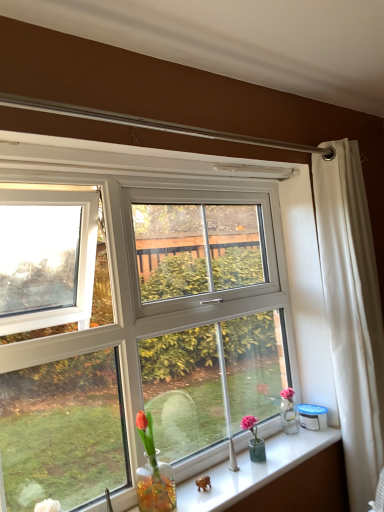
In order to face white fabric curtain at right, should I rotate leftwards or rightwards?

You should rotate right by 22.046 degrees.

What is the approximate width of white fabric curtain at right?

The width of white fabric curtain at right is 7.40 inches.

The image size is (384, 512). Describe the element at coordinates (352, 314) in the screenshot. I see `white fabric curtain at right` at that location.

You are a GUI agent. You are given a task and a screenshot of the screen. Output one action in this format:
    pyautogui.click(x=<x>, y=<y>)
    Task: Click on the white fabric curtain at right
    This screenshot has height=512, width=384.
    Given the screenshot: What is the action you would take?
    pyautogui.click(x=352, y=314)

What do you see at coordinates (253, 470) in the screenshot? This screenshot has width=384, height=512. I see `clear glass vase at lower center` at bounding box center [253, 470].

Locate an element on the screen. clear glass vase at lower center is located at coordinates (253, 470).

At what (x,y) coordinates should I click in order to perform the action: click on white fabric curtain at right. Please return your answer as a coordinate pair (x, y). This screenshot has width=384, height=512. Looking at the image, I should click on (352, 314).

Can you confirm if clear glass vase at lower center is positioned to the right of white fabric curtain at right?

In fact, clear glass vase at lower center is to the left of white fabric curtain at right.

In the scene shown: Who is more distant, clear glass vase at lower center or white fabric curtain at right?

white fabric curtain at right.

Which point is more forward, (311, 508) or (353, 231)?

Positioned in front is point (311, 508).

From the image's perspective, is clear glass vase at lower center below white fabric curtain at right?

Yes.

From a real-world perspective, does clear glass vase at lower center stand above white fabric curtain at right?

No, from a real-world perspective, clear glass vase at lower center is not over white fabric curtain at right

In the scene shown: Is clear glass vase at lower center wider or thinner than white fabric curtain at right?

Considering their sizes, clear glass vase at lower center looks broader than white fabric curtain at right.

Does clear glass vase at lower center have a greater height compared to white fabric curtain at right?

No.

Based on their sizes in the image, would you say clear glass vase at lower center is bigger or smaller than white fabric curtain at right?

In the image, clear glass vase at lower center appears to be smaller than white fabric curtain at right.

Choose the correct answer: Is clear glass vase at lower center inside white fabric curtain at right or outside it?

clear glass vase at lower center lies outside white fabric curtain at right.

In the scene shown: Is clear glass vase at lower center positioned far away from white fabric curtain at right?

No, clear glass vase at lower center is in close proximity to white fabric curtain at right.

Is clear glass vase at lower center positioned with its back to white fabric curtain at right?

clear glass vase at lower center is not turned away from white fabric curtain at right.

Locate an element on the screen. This screenshot has height=512, width=384. window sill below the white fabric curtain at right (from the image's perspective) is located at coordinates pos(253,470).

Is white fabric curtain at right to the left of clear glass vase at lower center from the viewer's perspective?

In fact, white fabric curtain at right is to the right of clear glass vase at lower center.

Which object is closer to the camera taking this photo, white fabric curtain at right or clear glass vase at lower center?

clear glass vase at lower center.

Is point (348, 214) less distant than point (128, 496)?

No, it is behind (128, 496).

From the image's perspective, is white fabric curtain at right below clear glass vase at lower center?

No.

From a real-world perspective, is white fabric curtain at right above or below clear glass vase at lower center?

Clearly, from a real-world perspective, white fabric curtain at right is above clear glass vase at lower center.

Which of these two, white fabric curtain at right or clear glass vase at lower center, is wider?

With larger width is clear glass vase at lower center.

Does white fabric curtain at right have a lesser height compared to clear glass vase at lower center?

No.

Can you confirm if white fabric curtain at right is smaller than clear glass vase at lower center?

No.

Is white fabric curtain at right surrounding clear glass vase at lower center?

No.

In the scene shown: Are white fabric curtain at right and clear glass vase at lower center far apart?

white fabric curtain at right is actually quite close to clear glass vase at lower center.

Does white fabric curtain at right turn towards clear glass vase at lower center?

No, white fabric curtain at right is not oriented towards clear glass vase at lower center.

How different are the orientations of white fabric curtain at right and clear glass vase at lower center in degrees?

1.21 degrees.

Identify the location of window sill on the left of white fabric curtain at right. (253, 470).

Identify the location of window sill in front of the white fabric curtain at right. (253, 470).

You are a GUI agent. You are given a task and a screenshot of the screen. Output one action in this format:
    pyautogui.click(x=<x>, y=<y>)
    Task: Click on the curtain that is above the clear glass vase at lower center (from a real-world perspective)
    The width and height of the screenshot is (384, 512).
    Given the screenshot: What is the action you would take?
    [x=352, y=314]